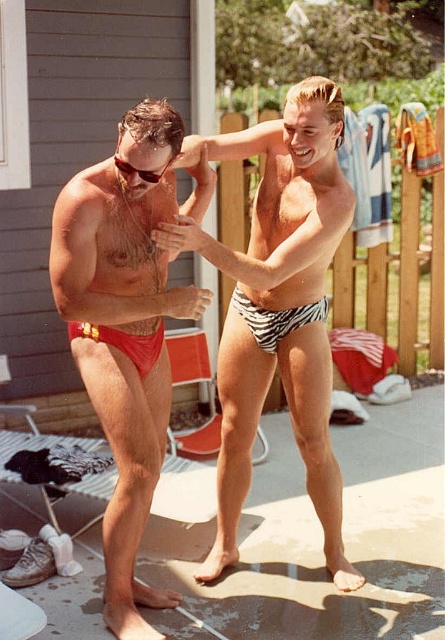
Is point (253, 435) positioned in front of point (140, 376)?

That is False.

Can you confirm if matte red swim trunks at left is shorter than matte red bikini bottom at lower left?

No, matte red swim trunks at left is not shorter than matte red bikini bottom at lower left.

Does point (75, 230) come closer to viewer compared to point (133, 340)?

Yes.

In order to click on matte red swim trunks at left in this screenshot , I will do `click(278, 305)`.

Based on the photo, which of these two, matte red bikini bottom at lower left or matte black sunglasses at upper center, stands shorter?

With less height is matte black sunglasses at upper center.

Between matte red bikini bottom at lower left and matte black sunglasses at upper center, which one is positioned lower?

matte red bikini bottom at lower left

Between point (114, 340) and point (152, 180), which one is positioned behind?

The point (114, 340) is more distant.

The image size is (445, 640). What are the coordinates of `matte red bikini bottom at lower left` in the screenshot? It's located at (124, 342).

Is matte red swim trunks at left to the left of matte black sunglasses at upper center from the viewer's perspective?

Incorrect, matte red swim trunks at left is not on the left side of matte black sunglasses at upper center.

I want to click on matte red swim trunks at left, so click(x=278, y=305).